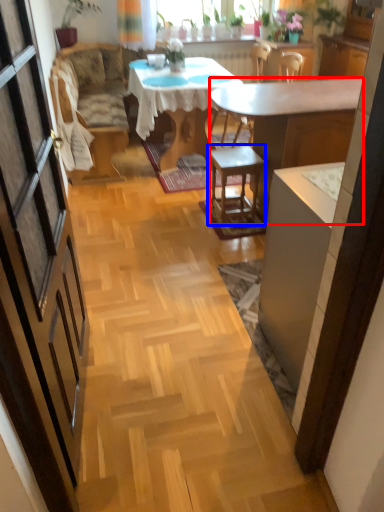
Question: Which object is closer to the camera taking this photo, desk (highlighted by a red box) or stool (highlighted by a blue box)?

Choices:
 (A) desk
 (B) stool

Answer: (A)